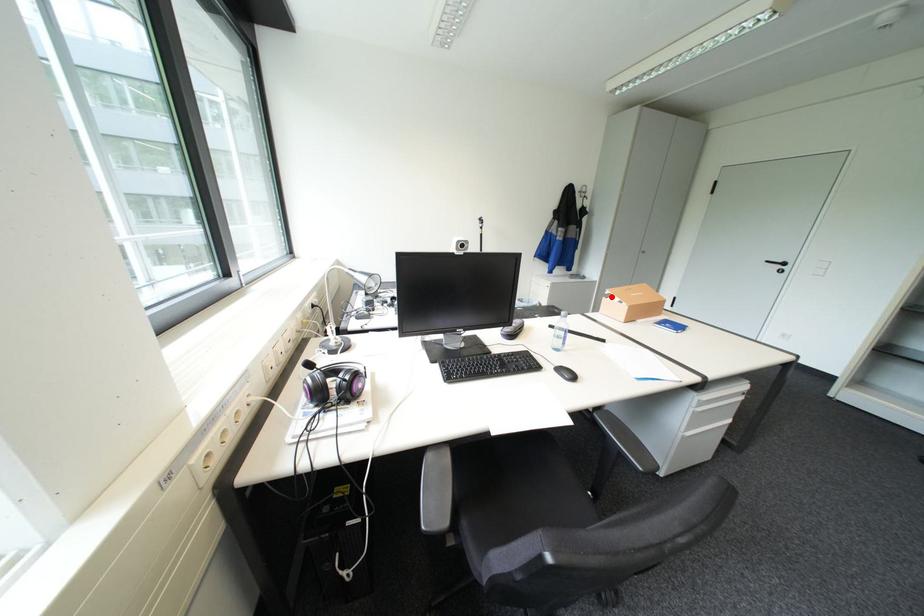
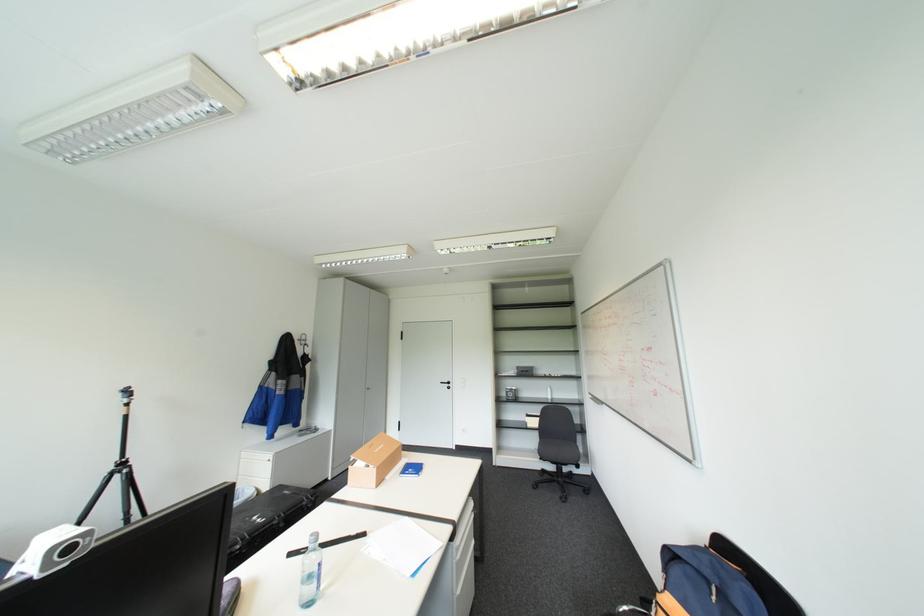
Question: I am providing you with two images of the same scene from different viewpoints. A red point is shown in image1. For the corresponding object point in image2, is it positioned nearer or farther from the camera?

Choices:
 (A) Nearer
 (B) Farther

Answer: (B)